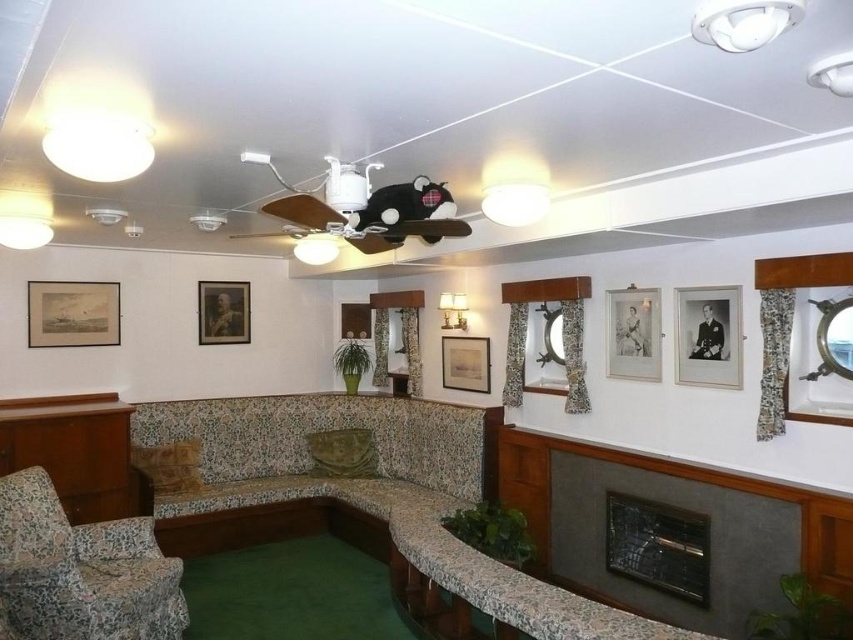
Can you confirm if silver metallic picture frame at center-right is thinner than matte wooden picture frame at center?

Yes, silver metallic picture frame at center-right is thinner than matte wooden picture frame at center.

Between point (643, 296) and point (485, 369), which one is positioned behind?

The point (485, 369) is behind.

You are a GUI agent. You are given a task and a screenshot of the screen. Output one action in this format:
    pyautogui.click(x=<x>, y=<y>)
    Task: Click on the silver metallic picture frame at center-right
    The width and height of the screenshot is (853, 640).
    Given the screenshot: What is the action you would take?
    [633, 333]

Which is more to the right, dark gray stone fireplace at lower right or silver metallic picture frame at right?

silver metallic picture frame at right is more to the right.

Is dark gray stone fireplace at lower right further to the viewer compared to silver metallic picture frame at right?

No, it is in front of silver metallic picture frame at right.

Who is more distant from viewer, (550, 536) or (709, 380)?

Point (550, 536)

This screenshot has width=853, height=640. In order to click on dark gray stone fireplace at lower right in this screenshot , I will do point(689,540).

Which is in front, point (99, 589) or point (138, 508)?

Point (99, 589) is in front.

Can you confirm if floral fabric armchair at lower left is positioned below wooden table at lower left?

Correct, floral fabric armchair at lower left is located below wooden table at lower left.

This screenshot has width=853, height=640. Describe the element at coordinates (80, 570) in the screenshot. I see `floral fabric armchair at lower left` at that location.

Locate an element on the screen. This screenshot has height=640, width=853. floral fabric armchair at lower left is located at coordinates (80, 570).